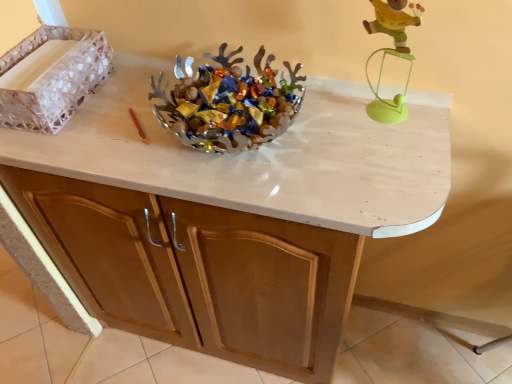
Locate an element on the screen. The height and width of the screenshot is (384, 512). free space above matte wood cabinet at center (from a real-world perspective) is located at coordinates (234, 143).